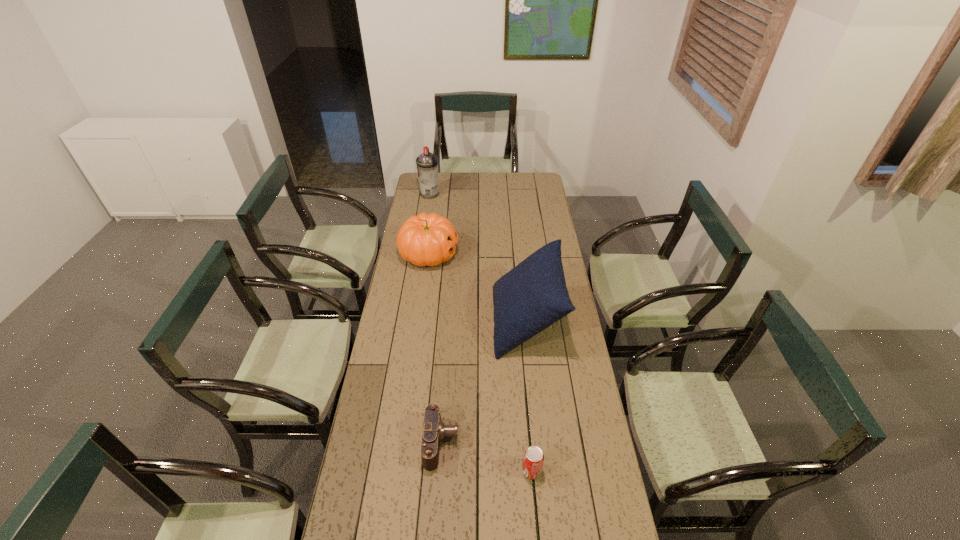
Find the location of `blank region between the third farthest object and the camera`. blank region between the third farthest object and the camera is located at coordinates (484, 382).

Find the location of a particular element. The width and height of the screenshot is (960, 540). object that stands as the second closest to the camera is located at coordinates (532, 296).

Find the location of `object that ranks as the third closest to the camera`. object that ranks as the third closest to the camera is located at coordinates (426, 239).

Locate an element on the screen. vacant region that satisfies the following two spatial constraints: 1. on the front-facing side of the camera; 2. on the back side of the soda can is located at coordinates (439, 471).

The width and height of the screenshot is (960, 540). Identify the location of free space that satisfies the following two spatial constraints: 1. on the carved face of the third shortest object; 2. on the back side of the soda can. (399, 471).

The width and height of the screenshot is (960, 540). What are the coordinates of `vacant space that satisfies the following two spatial constraints: 1. on the back side of the soda can; 2. on the carved face of the fourth nearest object` in the screenshot? It's located at (513, 254).

This screenshot has height=540, width=960. In order to click on blank space that satisfies the following two spatial constraints: 1. on the front-facing side of the camera; 2. on the left side of the soda can in this screenshot , I will do `click(439, 471)`.